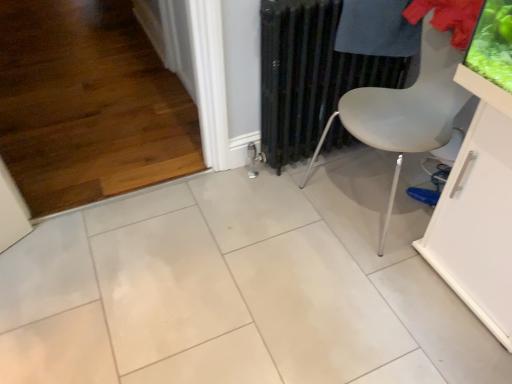
Question: Does point (270, 147) appear closer or farther from the camera than point (507, 216)?

Choices:
 (A) farther
 (B) closer

Answer: (A)

Question: Relative to white glossy table at lower right, is black metal radiator at center in front or behind?

Choices:
 (A) behind
 (B) front

Answer: (A)

Question: Which object is positioned farthest from the blue fabric shoe at lower right?

Choices:
 (A) white matte chair at center-right
 (B) white glossy table at lower right
 (C) dark blue fabric at upper right
 (D) black metal radiator at center

Answer: (C)

Question: Considering the real-world distances, which object is farthest from the white glossy table at lower right?

Choices:
 (A) blue fabric shoe at lower right
 (B) dark blue fabric at upper right
 (C) white matte chair at center-right
 (D) black metal radiator at center

Answer: (D)